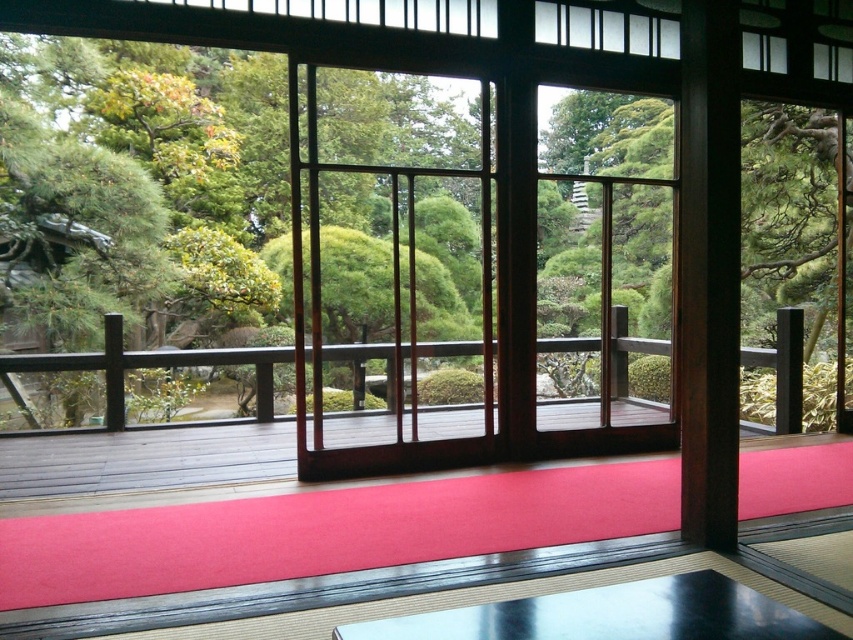
Looking at this image, you are standing in the room and looking towards the sliding doors. There are two points marked in the image, point (843, 140) and point (386, 518). Which point is closer to you?

Point (386, 518) is closer to you because it is less further to the camera than point (843, 140).

You are standing at the origin point of the coordinate system in the image. You want to walk to the green leafy tree at center. Which direction should you move in? Please provide your answer in terms of the coordinate system provided in the Objects Description.

The green leafy tree at center is located at coordinate point 0.370 on the x axis and 0.300 on the y axis. Since you are at the origin point, you should move in the positive x and positive y direction to reach it.